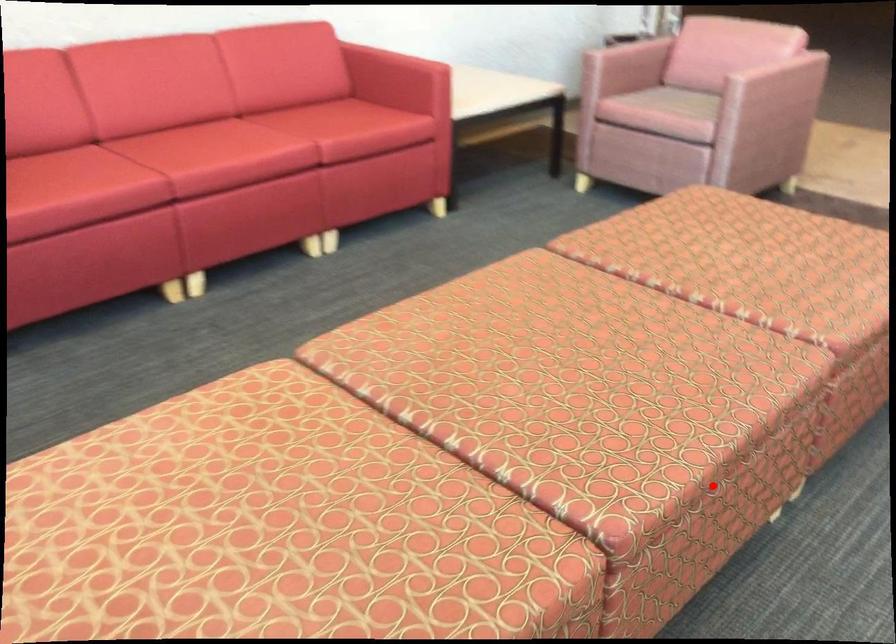
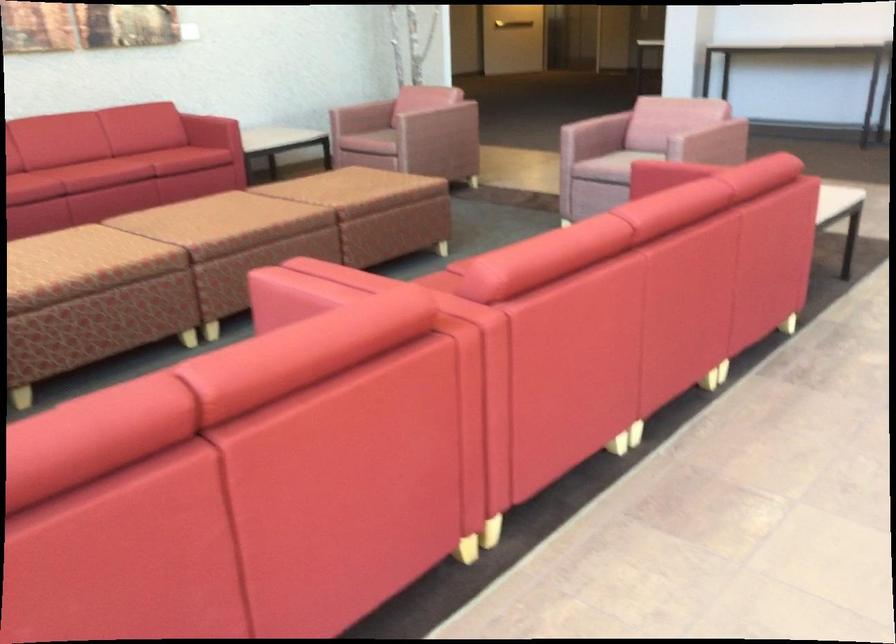
Question: I am providing you with two images of the same scene from different viewpoints. Image1 has a red point marked. In image2, the corresponding 3D location appears at what relative position? Reply with the corresponding letter.

Choices:
 (A) Closer
 (B) Farther

Answer: (B)